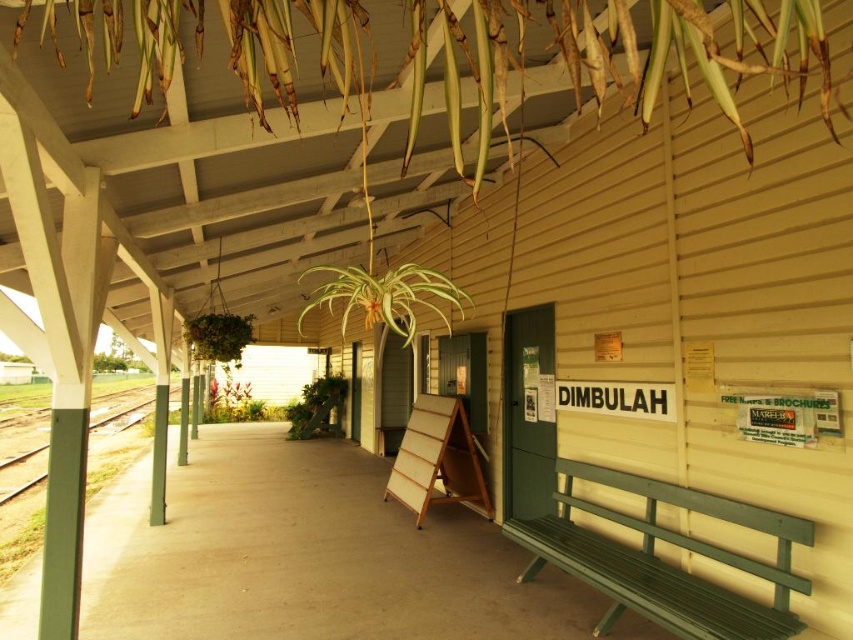
Is point (692, 586) behind point (189, 342)?

No, it is in front of (189, 342).

Who is more distant from viewer, (653, 483) or (223, 355)?

Positioned behind is point (223, 355).

Where is `green wooden bench at lower right`? The image size is (853, 640). green wooden bench at lower right is located at coordinates (664, 561).

Describe the element at coordinates (384, 296) in the screenshot. The image size is (853, 640). I see `green leafy plant at upper center` at that location.

Does green leafy plant at upper center have a smaller size compared to green leafy plant at upper left?

No, green leafy plant at upper center is not smaller than green leafy plant at upper left.

Which is in front, point (399, 296) or point (213, 348)?

Positioned in front is point (399, 296).

This screenshot has height=640, width=853. I want to click on green leafy plant at upper center, so click(384, 296).

Can you confirm if green wooden bench at lower right is thinner than green leafy plant at upper center?

Yes, green wooden bench at lower right is thinner than green leafy plant at upper center.

Does green wooden bench at lower right appear over green leafy plant at upper center?

Actually, green wooden bench at lower right is below green leafy plant at upper center.

Which is behind, point (563, 493) or point (378, 304)?

Point (563, 493)

Where is `green wooden bench at lower right`? green wooden bench at lower right is located at coordinates (664, 561).